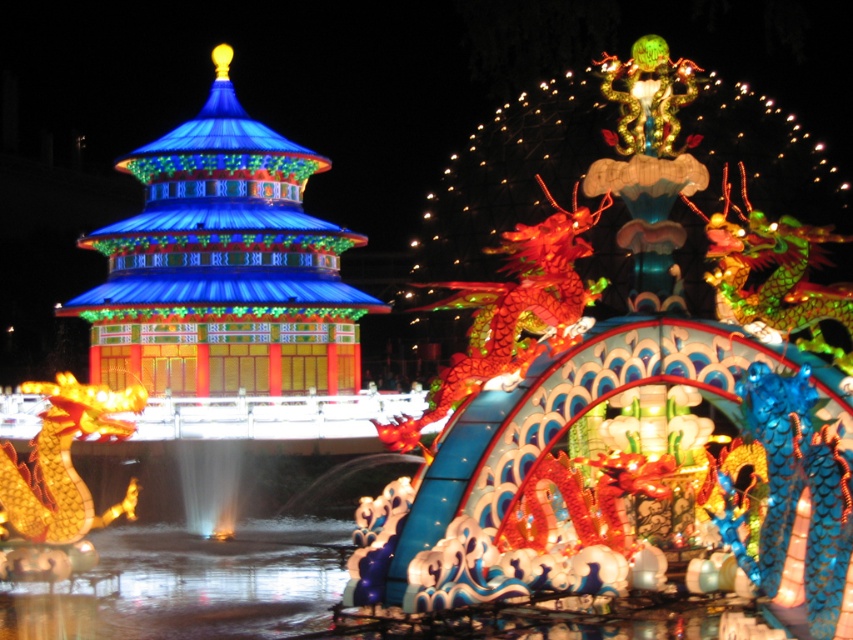
Question: Is shiny blue pagoda at center further to the viewer compared to clear liquid water at center?

Choices:
 (A) no
 (B) yes

Answer: (B)

Question: Observing the image, what is the correct spatial positioning of shiny blue pagoda at center in reference to clear liquid water at center?

Choices:
 (A) left
 (B) right

Answer: (A)

Question: Is shiny blue pagoda at center wider than clear liquid water at center?

Choices:
 (A) no
 (B) yes

Answer: (B)

Question: Which point is closer to the camera?

Choices:
 (A) (218, 392)
 (B) (163, 618)

Answer: (B)

Question: Which of the following is the closest to the observer?

Choices:
 (A) (134, 561)
 (B) (136, 157)

Answer: (A)

Question: Which of the following is the farthest from the observer?

Choices:
 (A) (74, 577)
 (B) (239, 148)

Answer: (B)